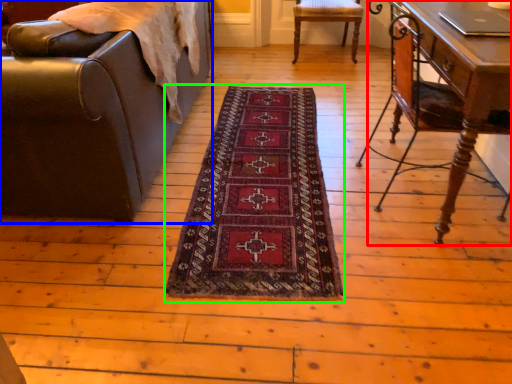
Question: Which object is the farthest from table (highlighted by a red box)? Choose among these: chair (highlighted by a blue box) or mat (highlighted by a green box).

Choices:
 (A) chair
 (B) mat

Answer: (A)